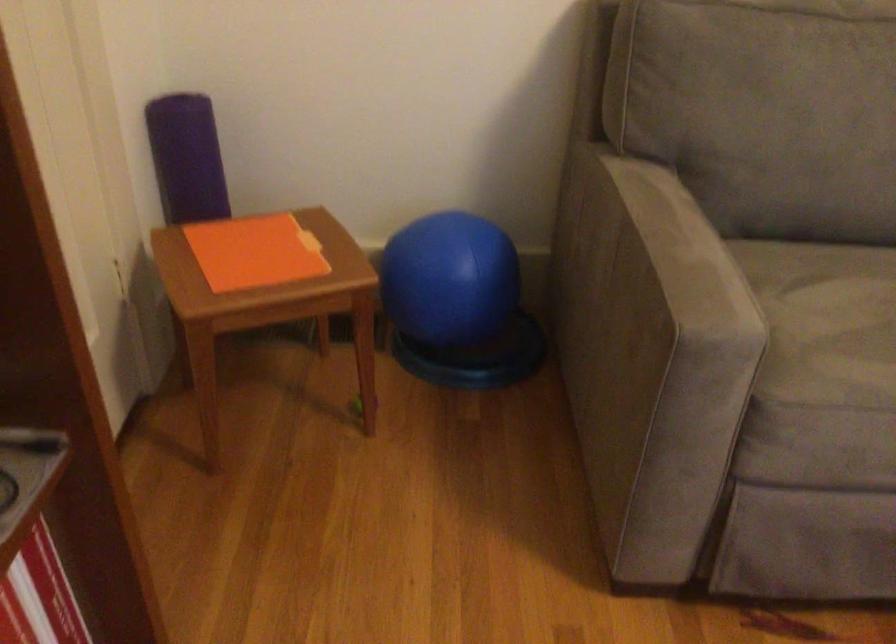
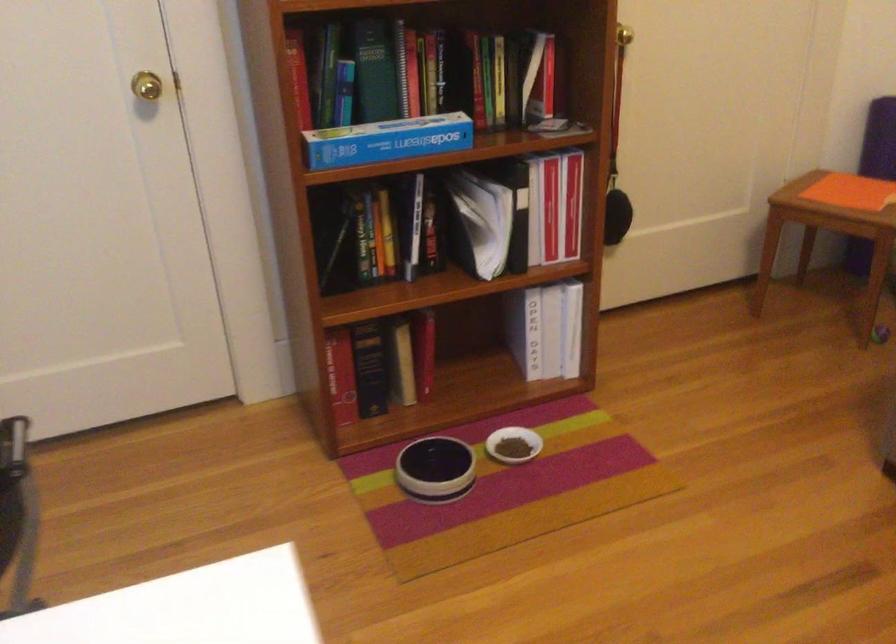
In the second image, find the point that corresponds to (x=282, y=263) in the first image.

(840, 196)